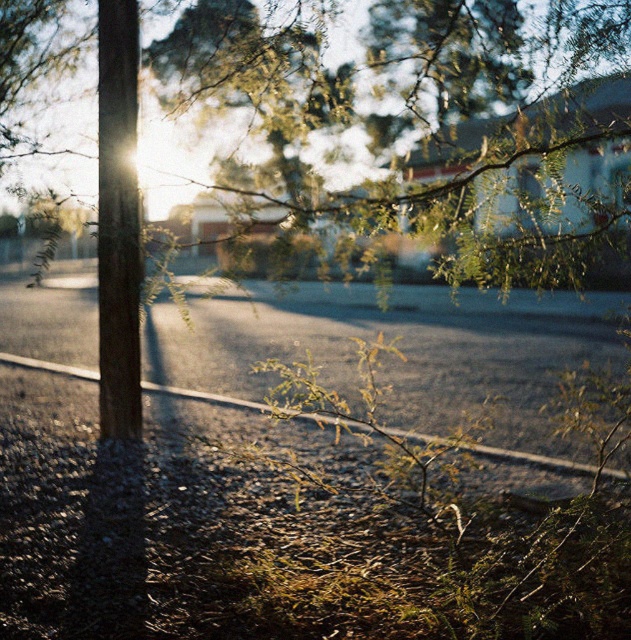
Question: Which object is farther from the camera taking this photo?

Choices:
 (A) green leafy branch at center
 (B) wooden pole at left

Answer: (B)

Question: Can you confirm if green leafy branch at center is thinner than wooden pole at left?

Choices:
 (A) yes
 (B) no

Answer: (B)

Question: From the image, what is the correct spatial relationship of green leafy branch at center in relation to wooden pole at left?

Choices:
 (A) below
 (B) above

Answer: (B)

Question: Which of the following is the farthest from the observer?

Choices:
 (A) wooden pole at left
 (B) green leafy branch at center

Answer: (A)

Question: Among these points, which one is nearest to the camera?

Choices:
 (A) coord(428,228)
 (B) coord(134,166)

Answer: (A)

Question: Does green leafy branch at center appear over wooden pole at left?

Choices:
 (A) no
 (B) yes

Answer: (B)